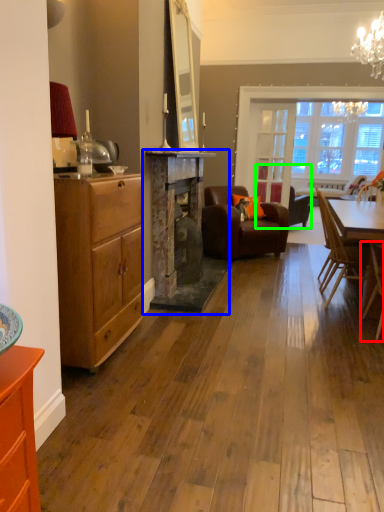
Question: Which is farther away from chair (highlighted by a red box)? fireplace (highlighted by a blue box) or chair (highlighted by a green box)?

Choices:
 (A) fireplace
 (B) chair

Answer: (B)